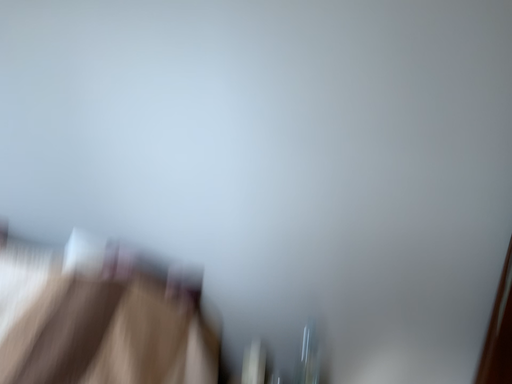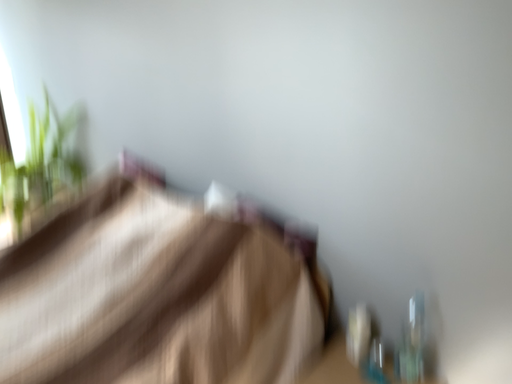
Question: How did the camera likely rotate when shooting the video?

Choices:
 (A) rotated left
 (B) rotated right

Answer: (A)